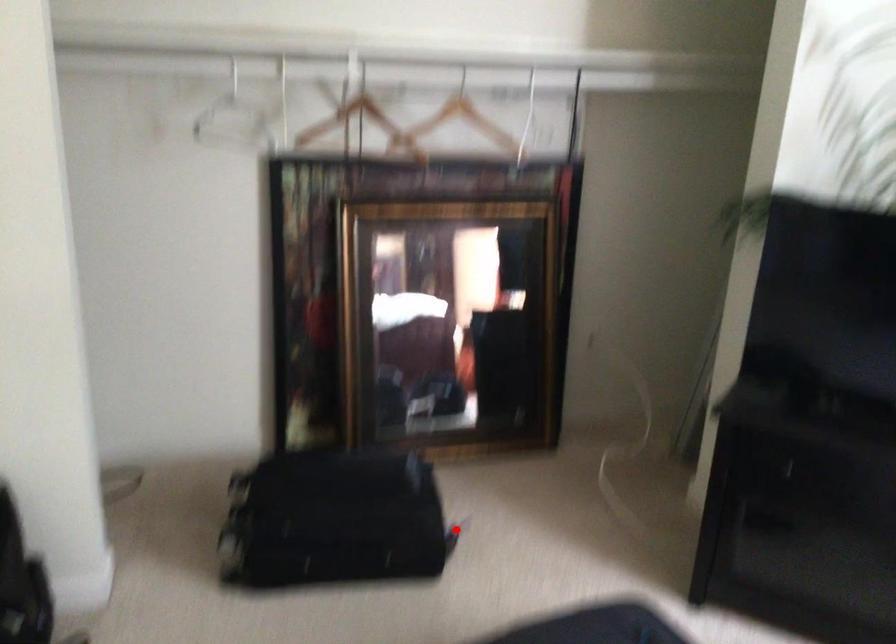
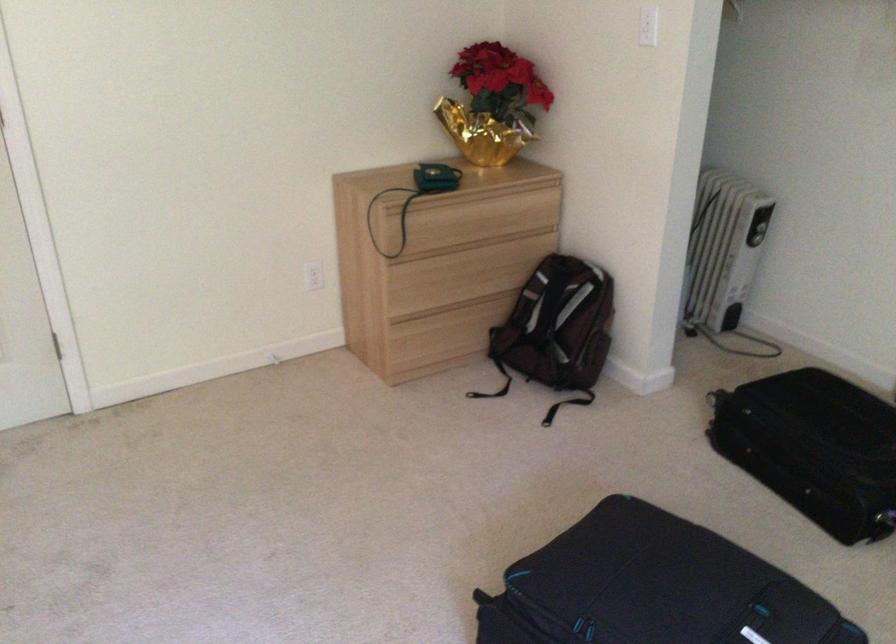
Question: I am providing you with two images of the same scene from different viewpoints. Given a red point in image1, look at the same physical point in image2. Is it:

Choices:
 (A) Closer to the viewpoint
 (B) Farther from the viewpoint

Answer: (A)